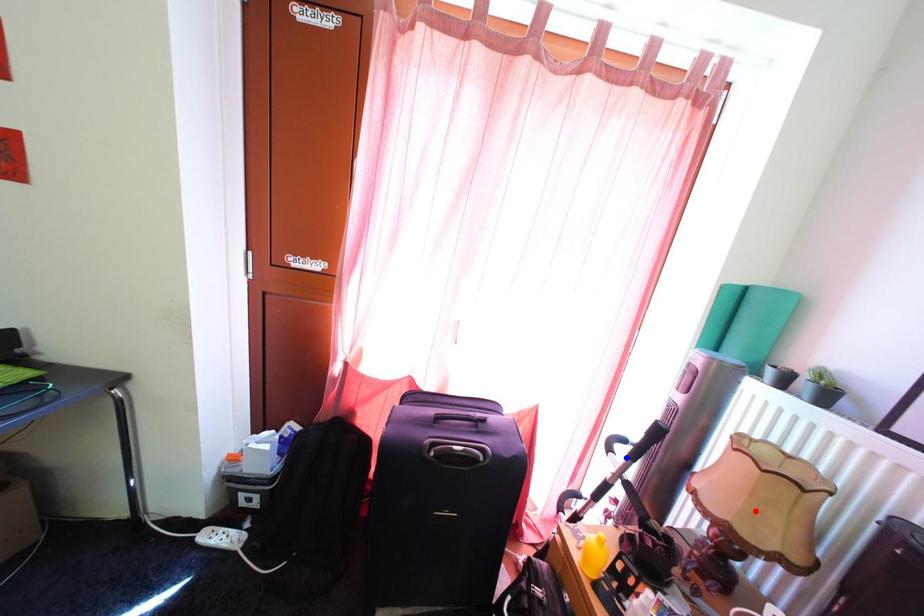
Question: Two points are marked on the image. Which point is closer to the camera?

Choices:
 (A) Blue point is closer.
 (B) Red point is closer.

Answer: (B)